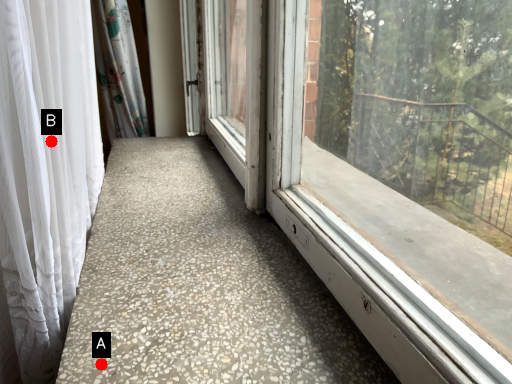
Question: Two points are circled on the image, labeled by A and B beside each circle. Among these points, which one is nearest to the camera?

Choices:
 (A) A is closer
 (B) B is closer

Answer: (A)